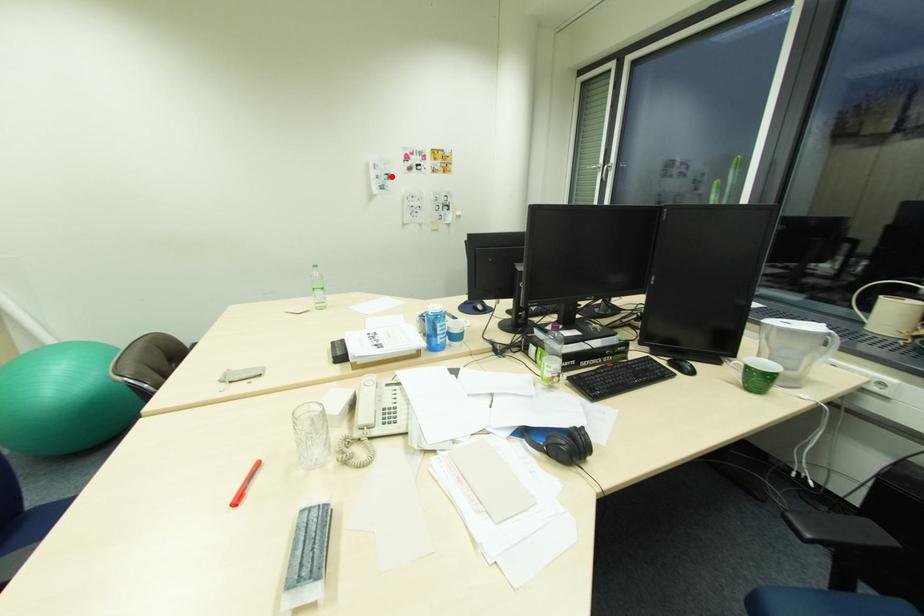
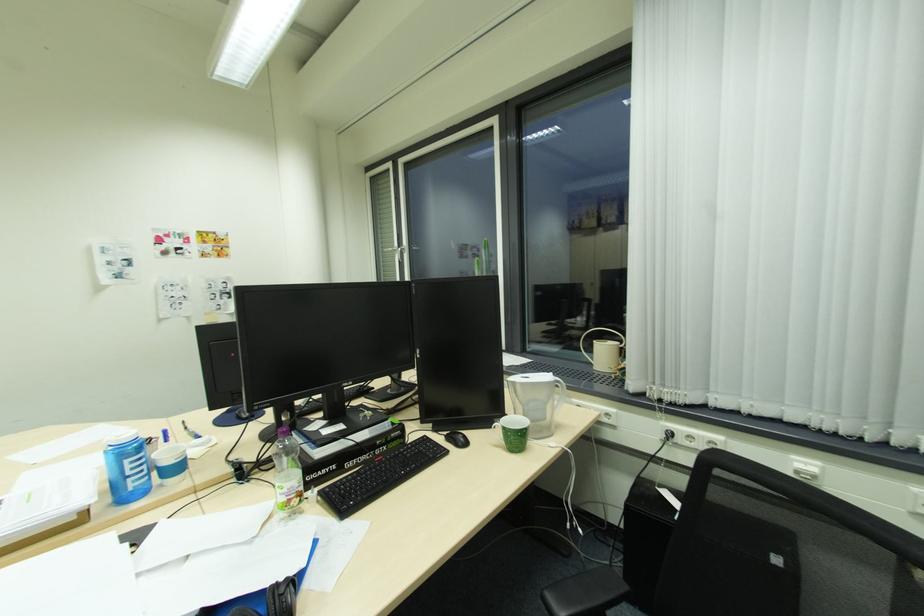
The point at the highlighted location is marked in the first image. Where is the corresponding point in the second image?

(131, 262)